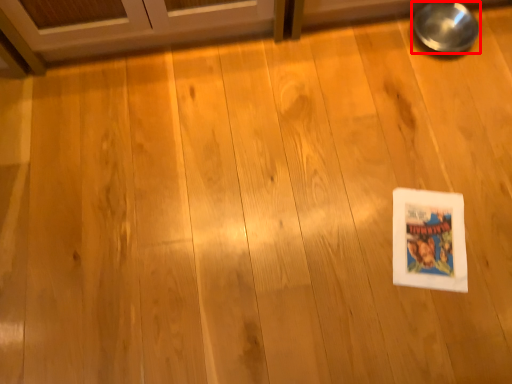
Question: Observing the image, what is the correct spatial positioning of bowl (annotated by the red box) in reference to comic book?

Choices:
 (A) right
 (B) left

Answer: (A)